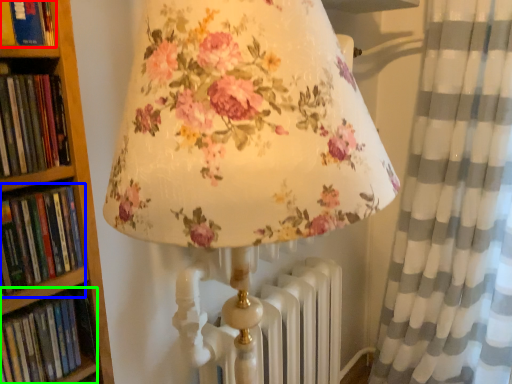
Question: Which is farther away from book (highlighted by a red box)? book (highlighted by a blue box) or book (highlighted by a green box)?

Choices:
 (A) book
 (B) book

Answer: (B)